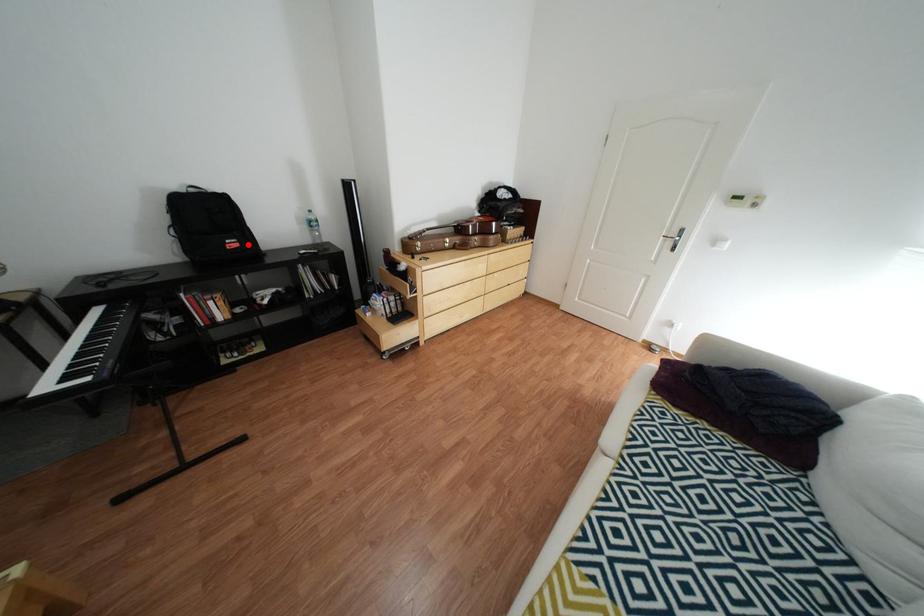
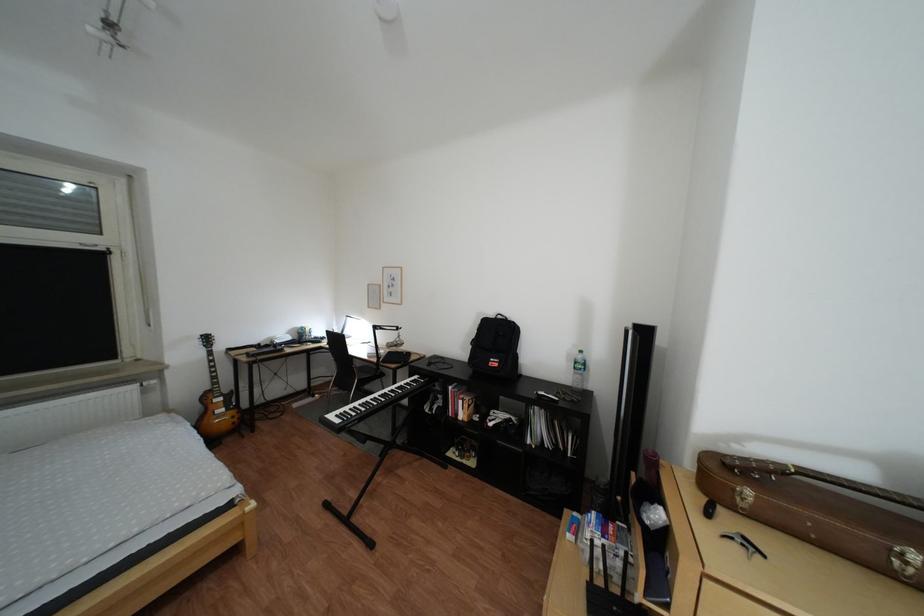
Where in the second image is the point corresponding to the highlighted location from the first image?

(509, 363)